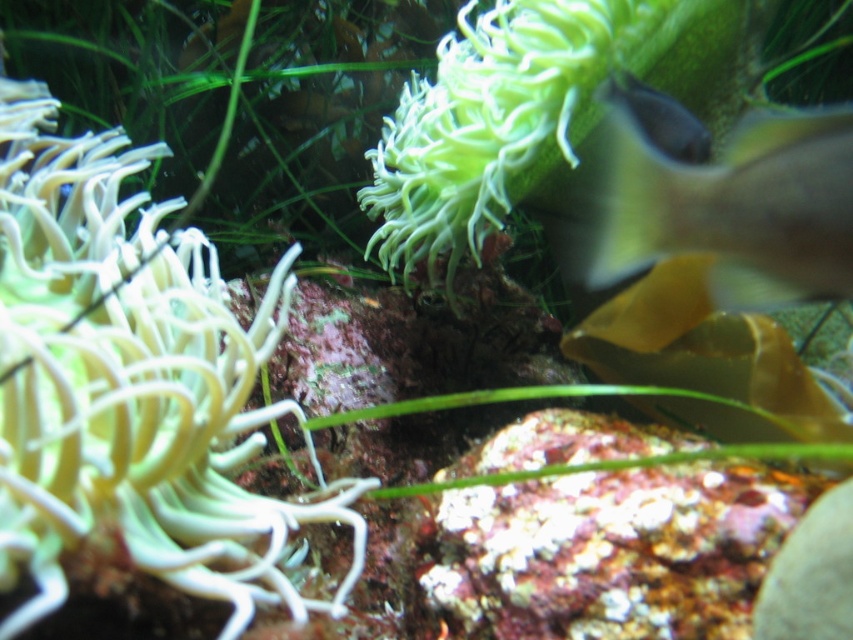
You are an underwater photographer aiming to capture a photo of the white soft coral at left and the translucent yellow fish at right. Based on their positions, which object should you focus on first if you want to include both in your shot without moving the camera?

The white soft coral at left is to the left of the translucent yellow fish at right, so you should focus on the white soft coral at left first to ensure both are in frame.

You are a marine biologist observing an underwater scene. You notice the white soft coral at left and the translucent yellow fish at right. Based on their positions, which object is closer to you?

The white soft coral at left is closer to you because it is positioned in front of the translucent yellow fish at right.